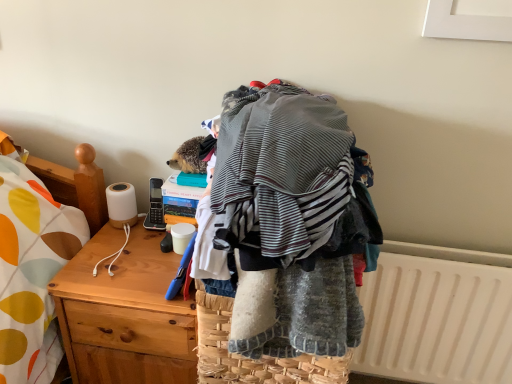
The width and height of the screenshot is (512, 384). Identify the location of free location above wooden desk at left (from a real-world perspective). (128, 262).